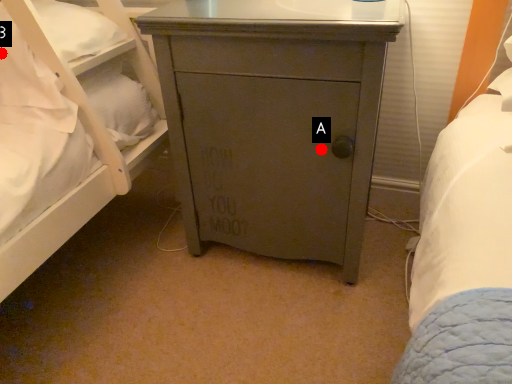
Question: Two points are circled on the image, labeled by A and B beside each circle. Which point is further to the camera?

Choices:
 (A) A is further
 (B) B is further

Answer: (B)